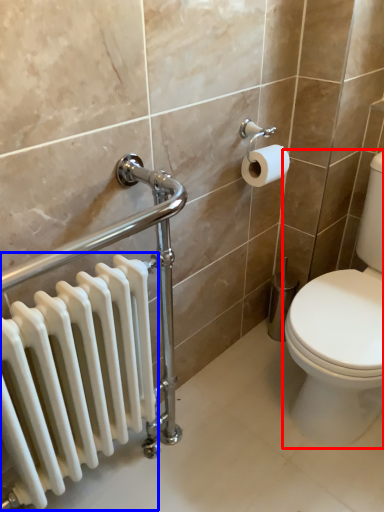
Question: Which of the following is the farthest to the observer, toilet (highlighted by a red box) or radiator (highlighted by a blue box)?

Choices:
 (A) toilet
 (B) radiator

Answer: (A)